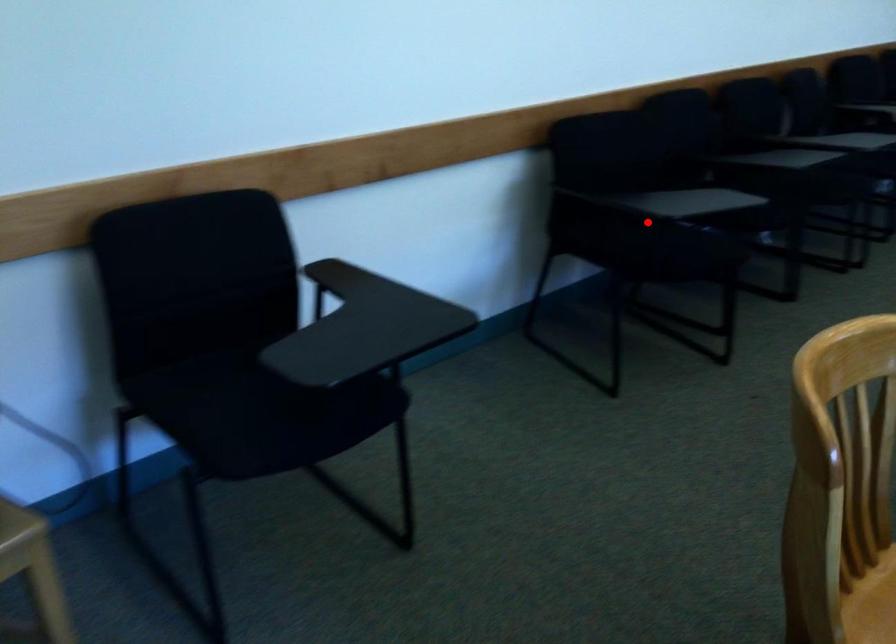
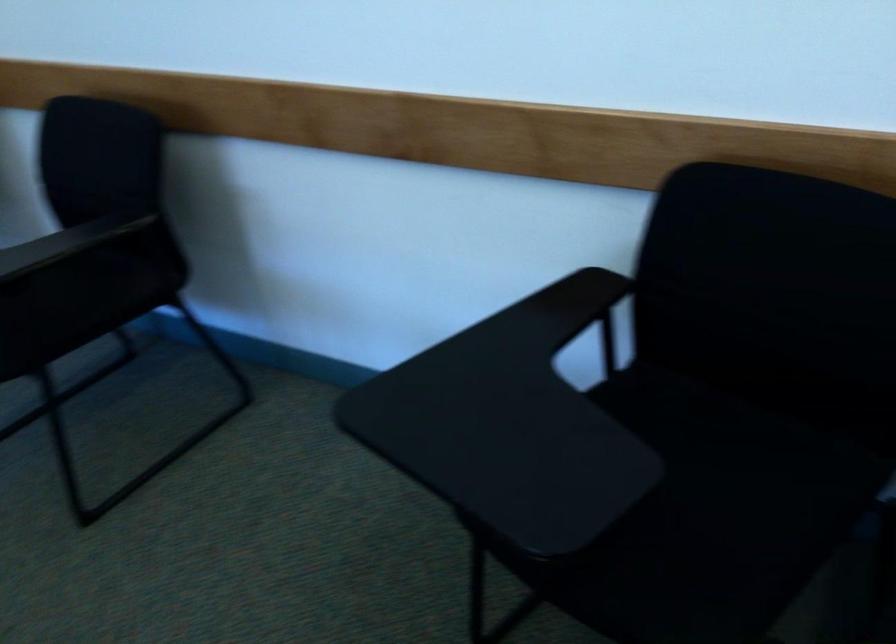
Question: I am providing you with two images of the same scene from different viewpoints. Given a red point in image1, look at the same physical point in image2. Is it:

Choices:
 (A) Closer to the viewpoint
 (B) Farther from the viewpoint

Answer: (A)